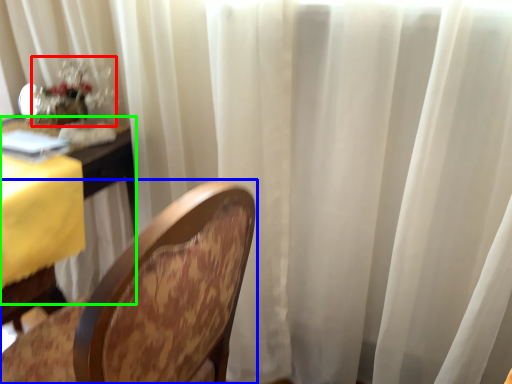
Question: Estimate the real-world distances between objects in this image. Which object is farther from floral arrangement (highlighted by a red box), chair (highlighted by a blue box) or table (highlighted by a green box)?

Choices:
 (A) chair
 (B) table

Answer: (A)